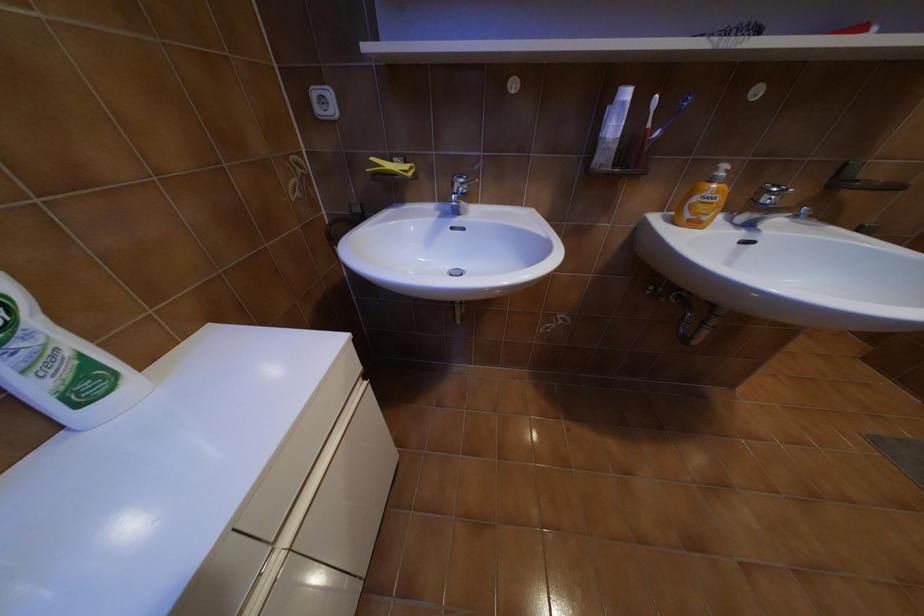
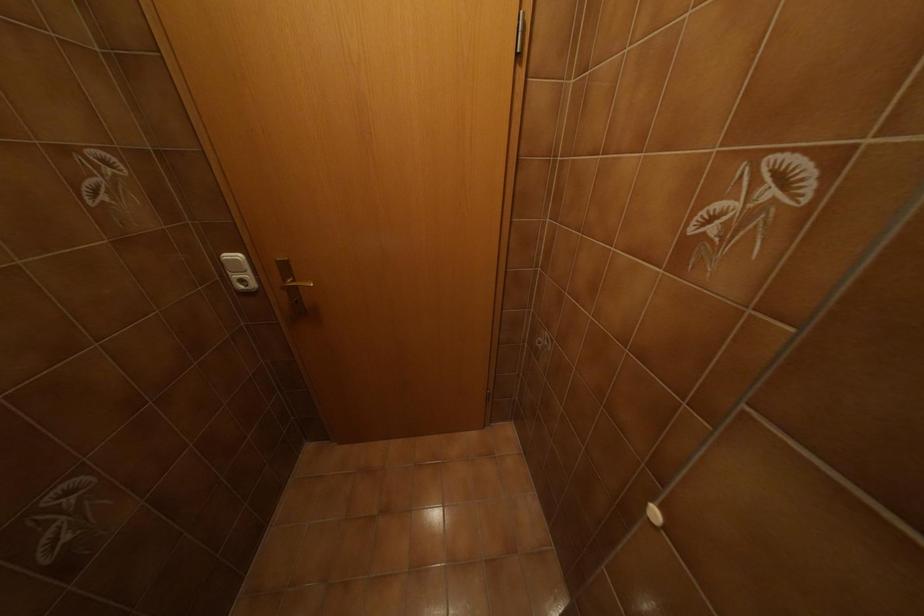
Question: Which direction would the cameraman need to move to produce the second image? Reply with the corresponding letter.

Choices:
 (A) Left
 (B) Right
 (C) Forward
 (D) Backward

Answer: (B)